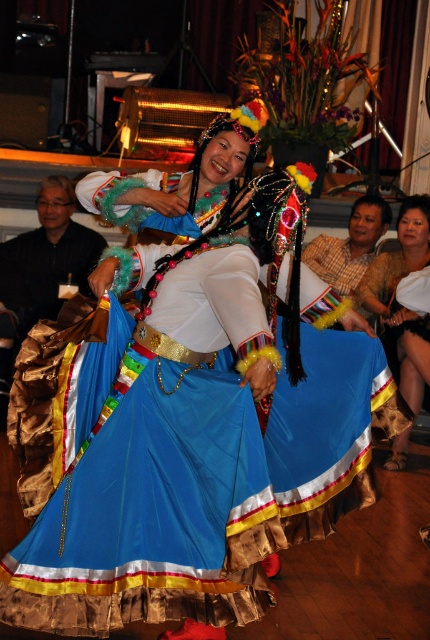
Who is positioned more to the right, matte brown jacket at left or silky brown dress at lower right?

silky brown dress at lower right

Who is taller, matte brown jacket at left or silky brown dress at lower right?

Standing taller between the two is silky brown dress at lower right.

This screenshot has height=640, width=430. I want to click on matte brown jacket at left, so click(x=46, y=257).

Which is behind, point (21, 292) or point (352, 282)?

The point (352, 282) is more distant.

Is point (34, 308) farther from viewer compared to point (358, 269)?

No, it is not.

The height and width of the screenshot is (640, 430). What are the coordinates of `matte brown jacket at left` in the screenshot? It's located at (46, 257).

Is blue satin dress at center above matte brown jacket at left?

No, blue satin dress at center is not above matte brown jacket at left.

Does blue satin dress at center have a larger size compared to matte brown jacket at left?

Yes, blue satin dress at center is bigger than matte brown jacket at left.

Image resolution: width=430 pixels, height=640 pixels. In order to click on blue satin dress at center in this screenshot , I will do `click(134, 481)`.

Where is `blue satin dress at center`? blue satin dress at center is located at coordinates (134, 481).